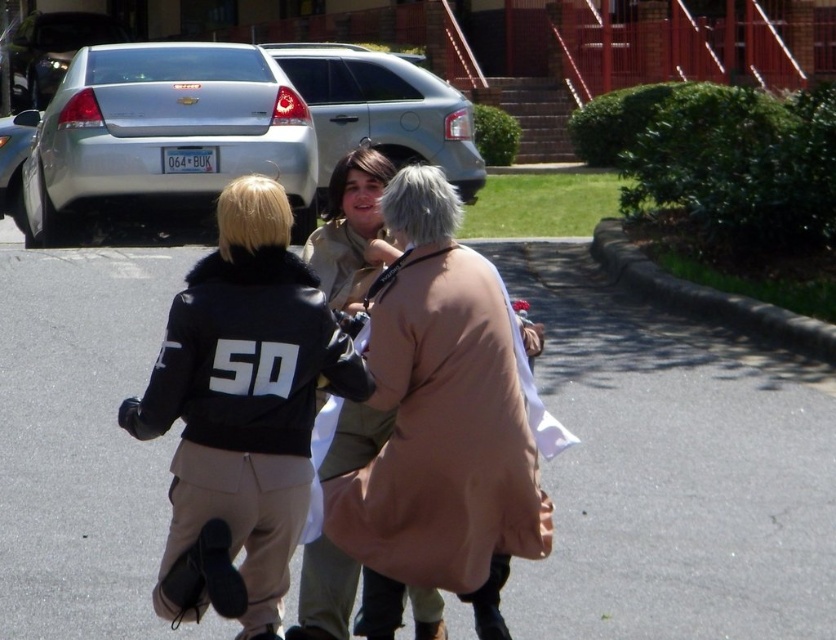
Question: Which of the following is the farthest from the observer?

Choices:
 (A) black leather jacket at center
 (B) satin silver sedan at upper left
 (C) satin silver suv at upper center

Answer: (B)

Question: Which object appears closest to the camera in this image?

Choices:
 (A) satin silver sedan at upper left
 (B) silver metallic sedan at upper left

Answer: (B)

Question: Which of these objects is positioned closest to the black leather jacket at center?

Choices:
 (A) silver metallic sedan at upper left
 (B) tan leather coat at center
 (C) satin silver sedan at upper left
 (D) satin silver suv at upper center

Answer: (B)

Question: Is the position of black leather jacket at center less distant than that of silver metallic sedan at upper left?

Choices:
 (A) no
 (B) yes

Answer: (B)

Question: Does satin silver suv at upper center have a smaller size compared to satin silver sedan at upper left?

Choices:
 (A) yes
 (B) no

Answer: (A)

Question: In this image, where is black leather jacket at center located relative to tan leather coat at center?

Choices:
 (A) right
 (B) left

Answer: (B)